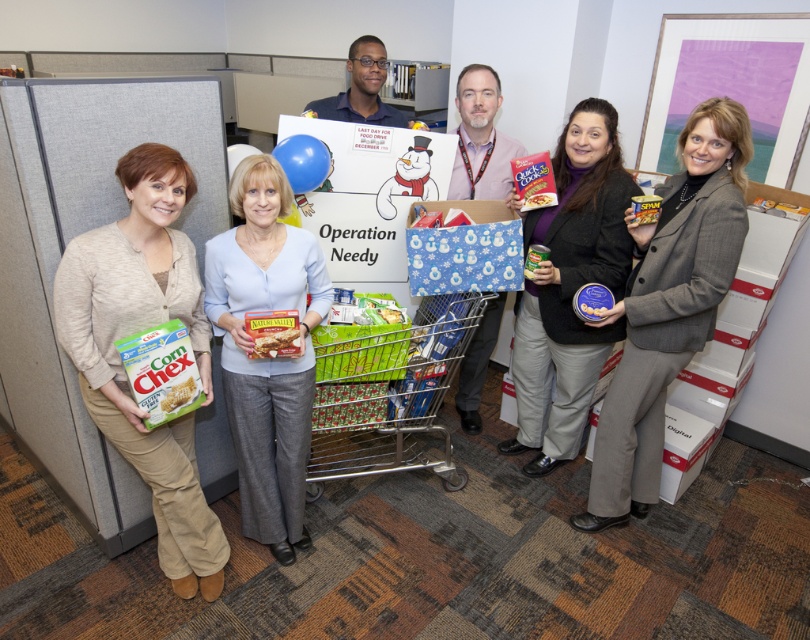
Question: Is matte gray blazer at right thinner than green matte corn chex at lower left?

Choices:
 (A) yes
 (B) no

Answer: (B)

Question: Is green matte corn chex at left below matte blue shirt at center?

Choices:
 (A) no
 (B) yes

Answer: (B)

Question: Is matte gray blazer at right to the left of matte black sweater at center from the viewer's perspective?

Choices:
 (A) no
 (B) yes

Answer: (A)

Question: Which point is farther to the camera?

Choices:
 (A) (133, 237)
 (B) (493, 170)
 (C) (340, 442)
 (D) (659, 220)

Answer: (C)

Question: Which point is closer to the camera?

Choices:
 (A) (248, 451)
 (B) (492, 122)
 (C) (211, 396)
 (D) (365, 369)

Answer: (C)

Question: Which point is closer to the camera?

Choices:
 (A) matte blue shirt at center
 (B) metallic shopping cart at center
 (C) green matte corn chex at left

Answer: (C)